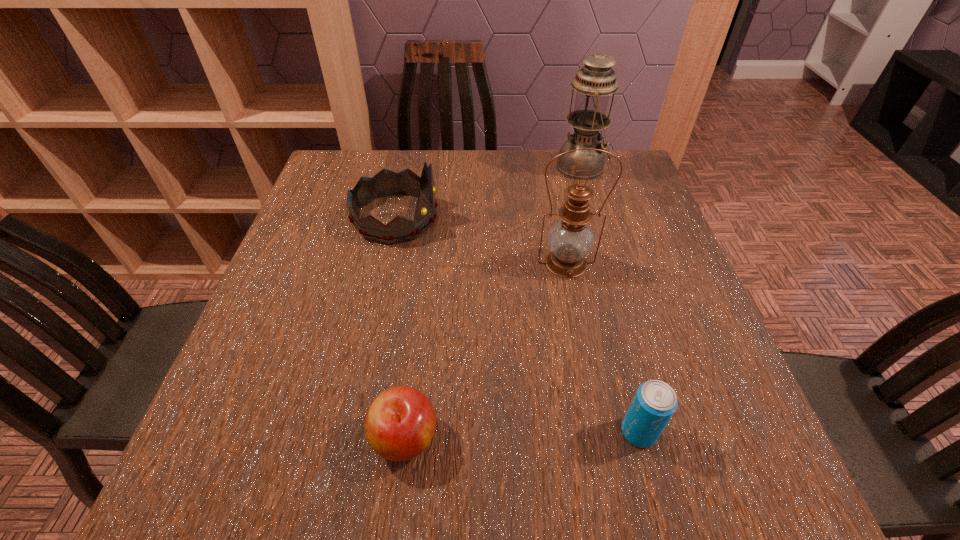
Image resolution: width=960 pixels, height=540 pixels. Find the location of `object located in the near right corner section of the desktop`. object located in the near right corner section of the desktop is located at coordinates (655, 402).

In the image, there is a desktop. Where is `vacant space at the far edge`? Image resolution: width=960 pixels, height=540 pixels. vacant space at the far edge is located at coordinates (459, 188).

Identify the location of blank space at the near edge of the desktop. Image resolution: width=960 pixels, height=540 pixels. (298, 467).

Where is `vacant space at the left edge of the desktop`? vacant space at the left edge of the desktop is located at coordinates (292, 348).

The image size is (960, 540). In the image, there is a desktop. Find the location of `vacant space at the right edge`. vacant space at the right edge is located at coordinates (726, 442).

Locate an element on the screen. The height and width of the screenshot is (540, 960). free space at the far left corner of the desktop is located at coordinates (363, 150).

In the image, there is a desktop. Where is `vacant space at the far right corner`? vacant space at the far right corner is located at coordinates (631, 194).

The height and width of the screenshot is (540, 960). Find the location of `empty space that is in between the second shortest object and the apple`. empty space that is in between the second shortest object and the apple is located at coordinates (521, 435).

Identify the location of free space between the second shortest object and the apple. (521, 435).

Where is `free space between the third shortest object and the shortest object`? This screenshot has width=960, height=540. free space between the third shortest object and the shortest object is located at coordinates (400, 328).